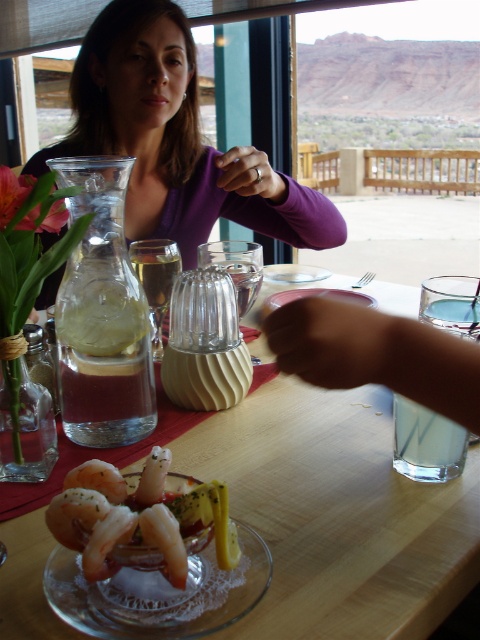
You are a server in a desert view restaurant. You need to deliver a drink to the customer whose purple fabric shirt at upper center is visible. However, there is a plate with shiny pink shrimp at center on the table. Can you reach the customer without moving the shrimp plate?

The purple fabric shirt at upper center is positioned over shiny pink shrimp at center, meaning the shirt is above the shrimp plate. Since the shirt is above the plate, the customer is likely seated behind the plate, so you can reach them without moving the shrimp plate.

You are a photographer taking a picture of the dining table. You notice two points marked in the image. Which point, point (279,211) or point (238,147), is closer to the camera?

Point (238,147) is closer to the camera than point (279,211).